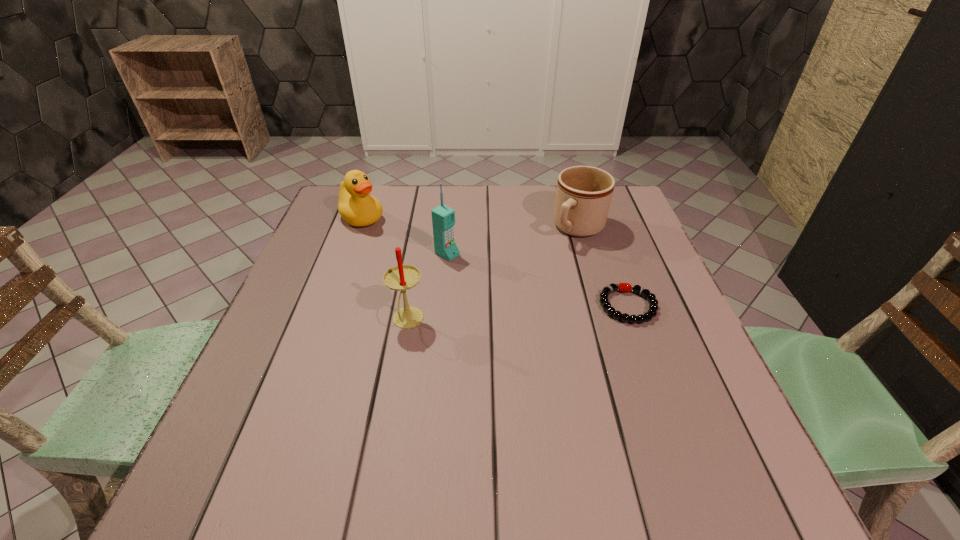
Locate an element on the screen. Image resolution: width=960 pixels, height=540 pixels. free space between the shortest object and the cellular telephone is located at coordinates (538, 280).

The image size is (960, 540). Find the location of `free spot between the mug and the fourth object from right to left`. free spot between the mug and the fourth object from right to left is located at coordinates (493, 275).

This screenshot has width=960, height=540. Identify the location of free spot between the third object from left to right and the fourth object from right to left. (427, 288).

Where is `free space between the second object from left to right and the bracelet`? free space between the second object from left to right and the bracelet is located at coordinates (517, 313).

Locate an element on the screen. blank region between the candle and the bracelet is located at coordinates (517, 313).

This screenshot has height=540, width=960. I want to click on vacant space that is in between the duck and the mug, so click(470, 224).

Where is `free space between the third object from left to right and the shortest object`? The width and height of the screenshot is (960, 540). free space between the third object from left to right and the shortest object is located at coordinates (538, 280).

Locate an element on the screen. free space between the candle and the shortest object is located at coordinates (517, 313).

Where is `the closest object to the third object from left to right`? This screenshot has height=540, width=960. the closest object to the third object from left to right is located at coordinates (402, 277).

Identify the location of object that ranks as the closest to the leftmost object. (443, 218).